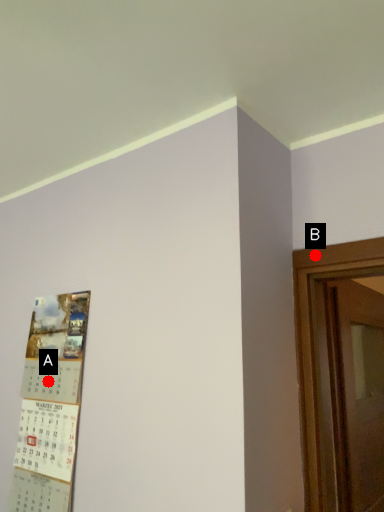
Question: Two points are circled on the image, labeled by A and B beside each circle. Which of the following is the farthest from the observer?

Choices:
 (A) A is further
 (B) B is further

Answer: (A)